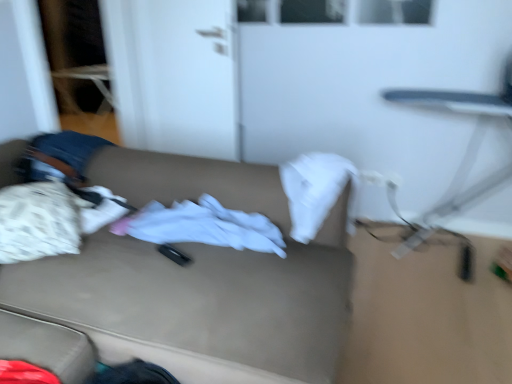
Question: Is white matte door at upper left positioned before metallic silver swivel chair at right?

Choices:
 (A) no
 (B) yes

Answer: (A)

Question: Does white matte door at upper left have a greater width compared to metallic silver swivel chair at right?

Choices:
 (A) no
 (B) yes

Answer: (A)

Question: Considering the relative sizes of white matte door at upper left and metallic silver swivel chair at right in the image provided, is white matte door at upper left taller than metallic silver swivel chair at right?

Choices:
 (A) yes
 (B) no

Answer: (A)

Question: From a real-world perspective, is white matte door at upper left positioned over metallic silver swivel chair at right based on gravity?

Choices:
 (A) yes
 (B) no

Answer: (A)

Question: Is white matte door at upper left shorter than metallic silver swivel chair at right?

Choices:
 (A) no
 (B) yes

Answer: (A)

Question: Is the depth of white matte door at upper left greater than that of metallic silver swivel chair at right?

Choices:
 (A) yes
 (B) no

Answer: (A)

Question: From the image's perspective, does beige fabric couch at center appear lower than white matte door at upper left?

Choices:
 (A) yes
 (B) no

Answer: (A)

Question: Is beige fabric couch at center not inside white matte door at upper left?

Choices:
 (A) yes
 (B) no

Answer: (A)

Question: Considering the relative sizes of beige fabric couch at center and white matte door at upper left in the image provided, is beige fabric couch at center thinner than white matte door at upper left?

Choices:
 (A) no
 (B) yes

Answer: (A)

Question: Is beige fabric couch at center closer to camera compared to white matte door at upper left?

Choices:
 (A) no
 (B) yes

Answer: (B)

Question: Can white matte door at upper left be found inside beige fabric couch at center?

Choices:
 (A) yes
 (B) no

Answer: (B)

Question: From the image's perspective, would you say beige fabric couch at center is positioned over white matte door at upper left?

Choices:
 (A) no
 (B) yes

Answer: (A)

Question: Is beige fabric couch at center turned away from white soft cloth at center?

Choices:
 (A) no
 (B) yes

Answer: (B)